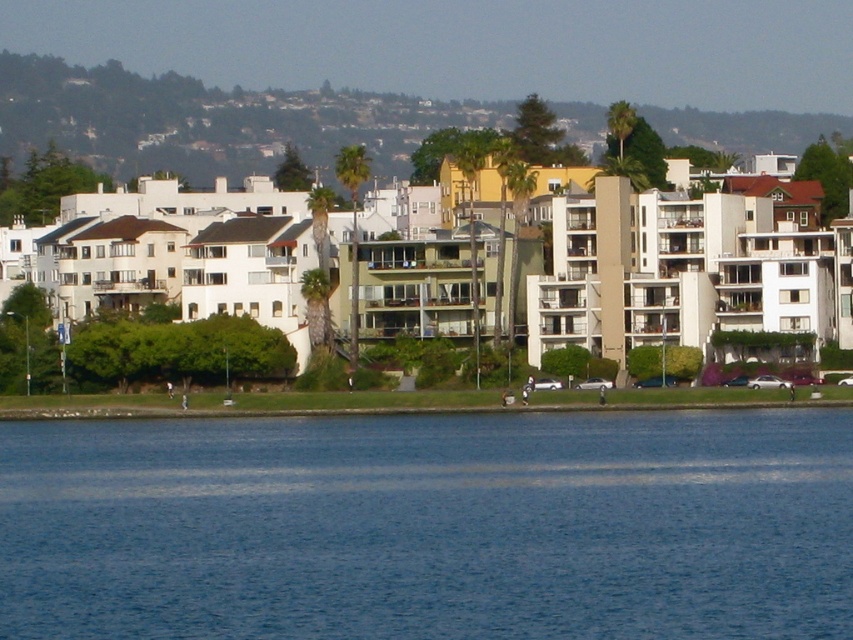
Question: Which point is closer to the camera?

Choices:
 (A) (747, 112)
 (B) (548, 577)

Answer: (B)

Question: Can you confirm if blue water at lower center is thinner than green leafy hillside at upper center?

Choices:
 (A) no
 (B) yes

Answer: (B)

Question: Does blue water at lower center appear over green leafy hillside at upper center?

Choices:
 (A) yes
 (B) no

Answer: (B)

Question: Does blue water at lower center appear under green leafy hillside at upper center?

Choices:
 (A) no
 (B) yes

Answer: (B)

Question: Which point is closer to the camera?

Choices:
 (A) (746, 611)
 (B) (817, 120)

Answer: (A)